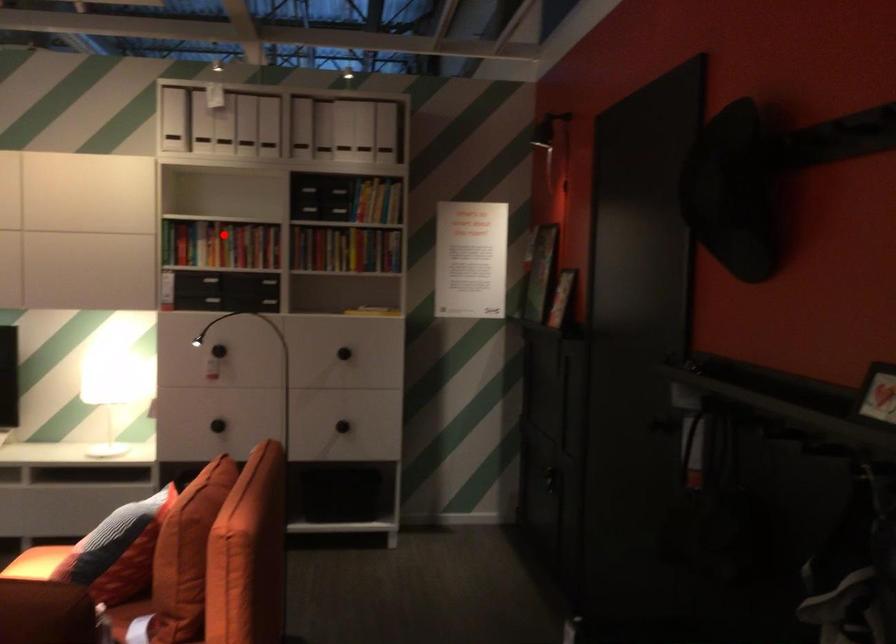
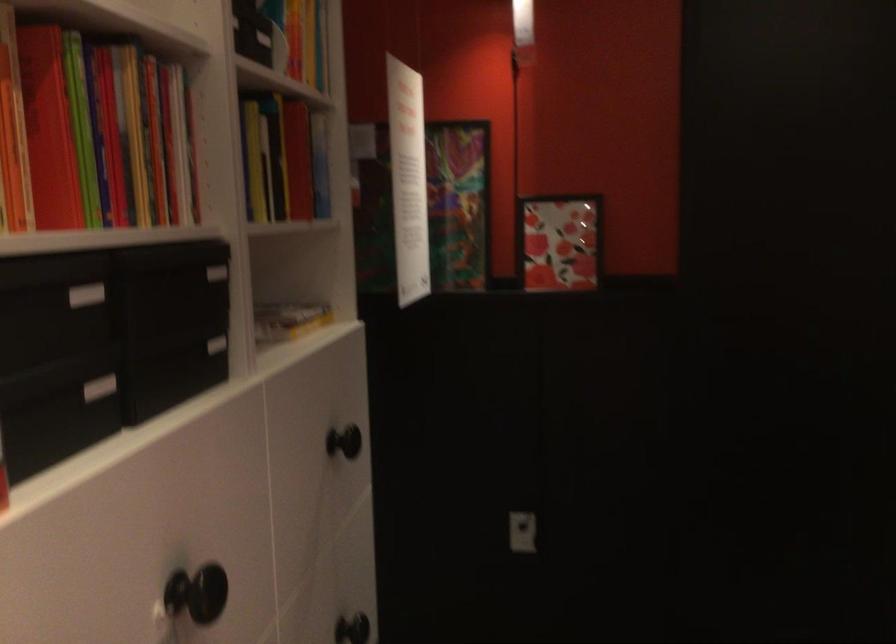
Where in the second image is the point corresponding to the highlighted location from the first image?

(99, 136)